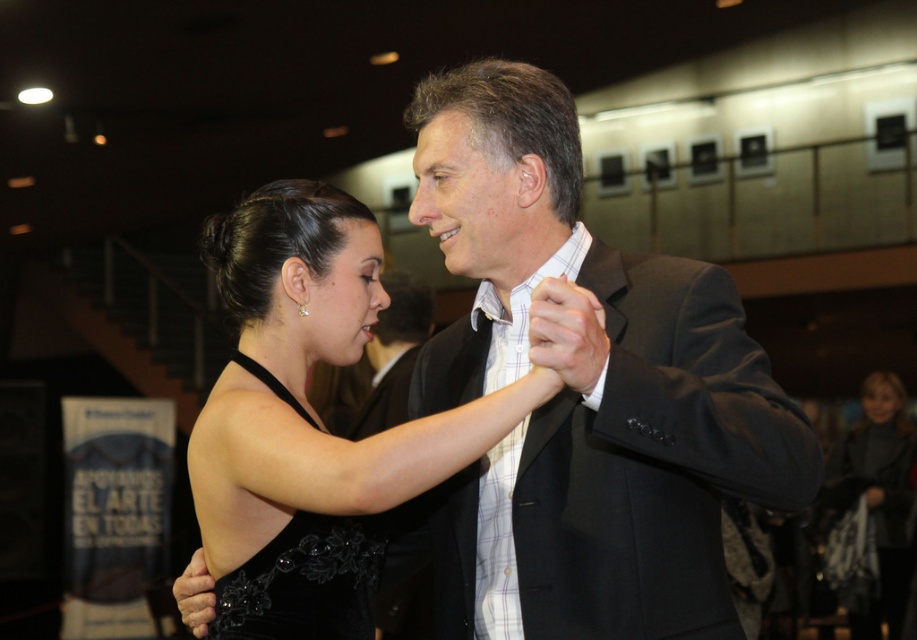
You are a photographer at a formal event. You need to place a spotlight exactly at the center of the black satin dress at center. According to the coordinates provided, where should you aim the spotlight?

The spotlight should be aimed at point coordinates [583,388], as that is the exact position of the black satin dress at center.

You are planning to wear both the black satin dress at center and the white checkered dress shirt at center for an event. Based on the image, which one do you think would require more space when moving around?

The black satin dress at center might require more space when moving around since it is wider than the white checkered dress shirt at center according to the image.